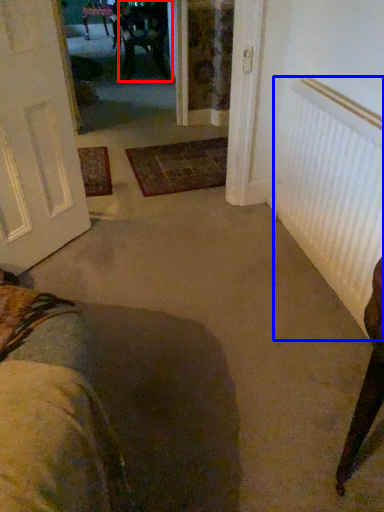
Question: Which object is closer to the camera taking this photo, chair (highlighted by a red box) or radiator (highlighted by a blue box)?

Choices:
 (A) chair
 (B) radiator

Answer: (B)